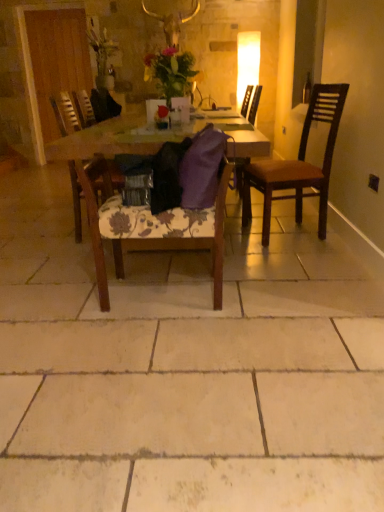
Question: From a real-world perspective, is wooden chair at center, which ranks as the second chair in left-to-right order, located higher than dark brown wood chair at right, the 3th chair positioned from the left?

Choices:
 (A) no
 (B) yes

Answer: (A)

Question: From a real-world perspective, is wooden chair at center, placed as the 2th chair when sorted from right to left, physically below dark brown wood chair at right, which appears as the first chair when viewed from the right?

Choices:
 (A) yes
 (B) no

Answer: (A)

Question: Is wooden chair at center, which ranks as the second chair in left-to-right order, at the right side of dark brown wood chair at right, the 3th chair positioned from the left?

Choices:
 (A) yes
 (B) no

Answer: (B)

Question: Does wooden chair at center, which ranks as the second chair in left-to-right order, have a smaller size compared to dark brown wood chair at right, which appears as the first chair when viewed from the right?

Choices:
 (A) yes
 (B) no

Answer: (A)

Question: Is wooden chair at center, which ranks as the second chair in left-to-right order, thinner than dark brown wood chair at right, the 3th chair positioned from the left?

Choices:
 (A) yes
 (B) no

Answer: (A)

Question: Does point (84, 133) appear closer or farther from the camera than point (150, 69)?

Choices:
 (A) farther
 (B) closer

Answer: (B)

Question: Considering the positions of wooden table at center and matte floral arrangement at center in the image, is wooden table at center wider or thinner than matte floral arrangement at center?

Choices:
 (A) wide
 (B) thin

Answer: (A)

Question: Relative to matte floral arrangement at center, is wooden table at center in front or behind?

Choices:
 (A) behind
 (B) front

Answer: (B)

Question: Is wooden table at center bigger or smaller than matte floral arrangement at center?

Choices:
 (A) big
 (B) small

Answer: (A)

Question: In terms of size, does dark brown wood chair at right, which appears as the first chair when viewed from the right, appear bigger or smaller than matte floral arrangement at center?

Choices:
 (A) small
 (B) big

Answer: (B)

Question: Would you say dark brown wood chair at right, the 3th chair positioned from the left, is to the left or to the right of matte floral arrangement at center in the picture?

Choices:
 (A) left
 (B) right

Answer: (B)

Question: Is dark brown wood chair at right, which appears as the first chair when viewed from the right, inside or outside of matte floral arrangement at center?

Choices:
 (A) outside
 (B) inside

Answer: (A)

Question: From the image's perspective, is dark brown wood chair at right, which appears as the first chair when viewed from the right, above or below matte floral arrangement at center?

Choices:
 (A) below
 (B) above

Answer: (A)

Question: Is transparent glass bottle at upper right to the left or to the right of wooden table at center in the image?

Choices:
 (A) right
 (B) left

Answer: (A)

Question: From the image's perspective, is transparent glass bottle at upper right located above or below wooden table at center?

Choices:
 (A) below
 (B) above

Answer: (B)